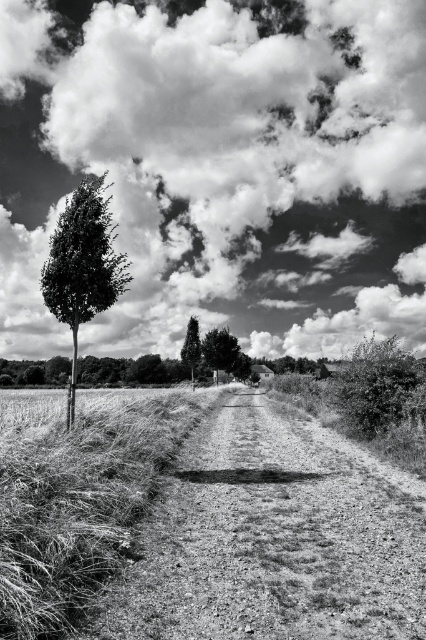
Question: Which is nearer to the green leafy tree at center?

Choices:
 (A) grassy field at left
 (B) smooth green tree at center
 (C) thorny bush at right
 (D) fluffy cotton cloud at upper center

Answer: (B)

Question: Can you confirm if dirt/gravel road at center is positioned below grassy field at left?

Choices:
 (A) no
 (B) yes

Answer: (B)

Question: Which is nearer to the smooth green tree at center?

Choices:
 (A) dirt/gravel road at center
 (B) grassy field at left
 (C) fluffy cotton cloud at upper center

Answer: (A)

Question: Which object is the closest to the dirt/gravel road at center?

Choices:
 (A) fluffy cotton cloud at upper center
 (B) green leafy tree at center
 (C) thorny bush at right

Answer: (C)

Question: Can you confirm if dirt/gravel road at center is bigger than green leafy tree at center?

Choices:
 (A) yes
 (B) no

Answer: (B)

Question: Can you confirm if grassy field at left is smaller than smooth green tree at left?

Choices:
 (A) yes
 (B) no

Answer: (A)